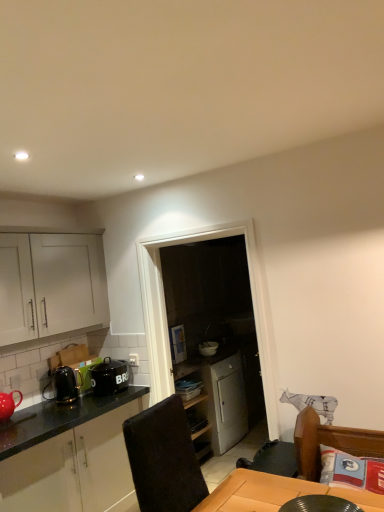
Question: Does black glossy plate at lower center, which ranks as the 1th appliance in front-to-back order, have a larger size compared to brown leather swivel chair at lower right?

Choices:
 (A) no
 (B) yes

Answer: (A)

Question: Can you confirm if black glossy plate at lower center, the third appliance positioned from the back, is shorter than brown leather swivel chair at lower right?

Choices:
 (A) no
 (B) yes

Answer: (B)

Question: Would you consider black glossy plate at lower center, the 3th appliance when ordered from left to right, to be distant from brown leather swivel chair at lower right?

Choices:
 (A) yes
 (B) no

Answer: (B)

Question: From the image's perspective, does black glossy plate at lower center, which ranks as the 1th appliance in front-to-back order, appear lower than brown leather swivel chair at lower right?

Choices:
 (A) no
 (B) yes

Answer: (A)

Question: Does black glossy plate at lower center, which ranks as the 1th appliance in front-to-back order, touch brown leather swivel chair at lower right?

Choices:
 (A) yes
 (B) no

Answer: (B)

Question: Is matte red teapot at lower left wider or thinner than white glossy bowl at center, which is counted as the 1th appliance, starting from the back?

Choices:
 (A) wide
 (B) thin

Answer: (B)

Question: From a real-world perspective, is matte red teapot at lower left positioned above or below white glossy bowl at center, which is the 2th appliance from left to right?

Choices:
 (A) above
 (B) below

Answer: (A)

Question: Visually, is matte red teapot at lower left positioned to the left or to the right of white glossy bowl at center, which is the 2th appliance from left to right?

Choices:
 (A) left
 (B) right

Answer: (A)

Question: Is point tap(6, 412) positioned closer to the camera than point tap(205, 352)?

Choices:
 (A) closer
 (B) farther

Answer: (A)

Question: Looking at their shapes, would you say black ceramic pot at left is wider or thinner than white glossy cabinet at left, the 3th cabinetry from the top?

Choices:
 (A) wide
 (B) thin

Answer: (B)

Question: Do you think black ceramic pot at left is within white glossy cabinet at left, which is the 1th cabinetry from bottom to top, or outside of it?

Choices:
 (A) inside
 (B) outside

Answer: (B)

Question: Is point (125, 382) closer or farther from the camera than point (84, 459)?

Choices:
 (A) farther
 (B) closer

Answer: (A)

Question: In the image, is black ceramic pot at left positioned in front of or behind white glossy cabinet at left, which is the 1th cabinetry from bottom to top?

Choices:
 (A) behind
 (B) front

Answer: (A)

Question: Considering the positions of black ceramic pot at left and shiny black kettle at left, the 1th appliance from the left, in the image, is black ceramic pot at left bigger or smaller than shiny black kettle at left, the 1th appliance from the left,?

Choices:
 (A) small
 (B) big

Answer: (B)

Question: Choose the correct answer: Is black ceramic pot at left inside shiny black kettle at left, placed as the 2th appliance when sorted from back to front, or outside it?

Choices:
 (A) outside
 (B) inside

Answer: (A)